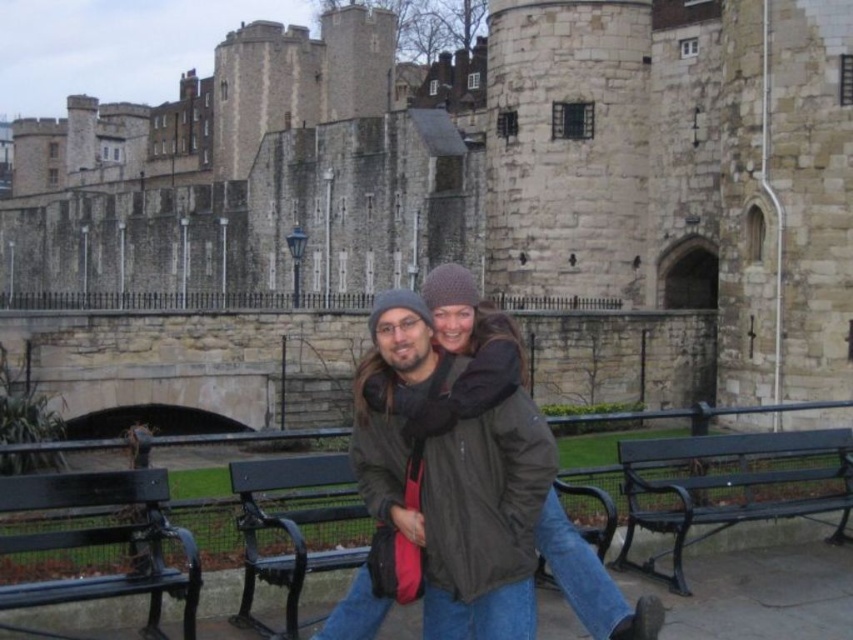
Can you confirm if green painted metal bench at lower right is wider than green painted wood bench at center?

In fact, green painted metal bench at lower right might be narrower than green painted wood bench at center.

Who is more distant from viewer, (668, 582) or (281, 486)?

Positioned behind is point (668, 582).

Where is `green painted metal bench at lower right`? This screenshot has height=640, width=853. green painted metal bench at lower right is located at coordinates (730, 484).

Is dark brown leather jacket at center above green painted wood bench at center?

Indeed, dark brown leather jacket at center is positioned over green painted wood bench at center.

The height and width of the screenshot is (640, 853). What do you see at coordinates (469, 346) in the screenshot? I see `dark brown leather jacket at center` at bounding box center [469, 346].

Find the location of a particular element. This screenshot has width=853, height=640. dark brown leather jacket at center is located at coordinates tap(469, 346).

Can you confirm if dark brown leather jacket at center is positioned below black metal bench at center?

No, dark brown leather jacket at center is not below black metal bench at center.

Is dark brown leather jacket at center above black metal bench at center?

Indeed, dark brown leather jacket at center is positioned over black metal bench at center.

Does point (473, 369) lie in front of point (338, 472)?

Yes.

Locate an element on the screen. dark brown leather jacket at center is located at coordinates (469, 346).